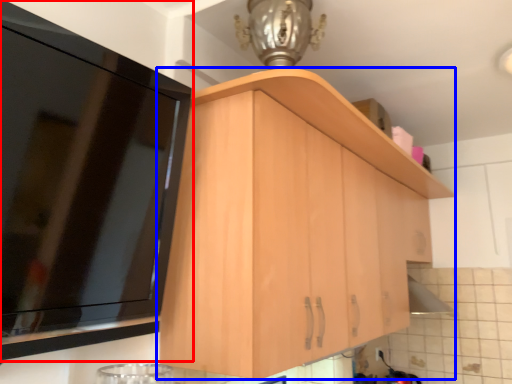
Question: Which of the following is the farthest to the observer, cabinetry (highlighted by a red box) or cabinetry (highlighted by a blue box)?

Choices:
 (A) cabinetry
 (B) cabinetry

Answer: (B)